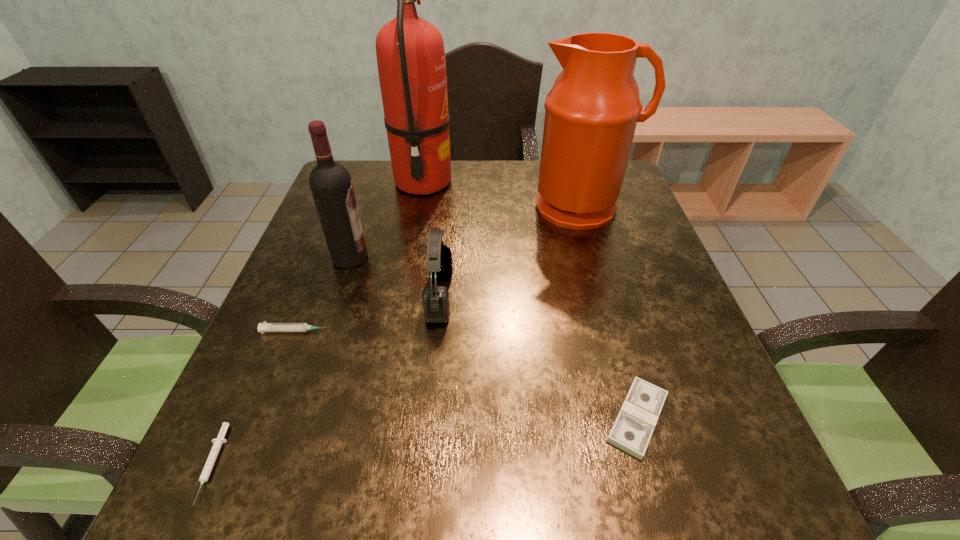
Find the location of a particular element. This screenshot has height=540, width=960. vacant area between the fifth shortest object and the second tallest object is located at coordinates (466, 232).

The width and height of the screenshot is (960, 540). I want to click on free space between the tallest object and the fifth shortest object, so click(x=387, y=220).

Image resolution: width=960 pixels, height=540 pixels. In order to click on free space between the wine bottle and the nearer syringe in this screenshot , I will do `click(280, 361)`.

Locate an element on the screen. The width and height of the screenshot is (960, 540). unoccupied position between the shorter syringe and the tallest object is located at coordinates (318, 323).

Image resolution: width=960 pixels, height=540 pixels. I want to click on object that is the fifth closest to the fourth tallest object, so click(632, 430).

Image resolution: width=960 pixels, height=540 pixels. In order to click on object that stands as the fourth closest to the fire extinguisher in this screenshot , I will do `click(263, 327)`.

Where is `vacant space that satisfies the following two spatial constraints: 1. on the back side of the dollar; 2. at the needle end of the taller syringe`? vacant space that satisfies the following two spatial constraints: 1. on the back side of the dollar; 2. at the needle end of the taller syringe is located at coordinates (612, 331).

At what (x,y) coordinates should I click in order to perform the action: click on free spot that satisfies the following two spatial constraints: 1. from the spout of the water jug; 2. at the needle end of the taller syringe. Please return your answer as a coordinate pair (x, y). The image size is (960, 540). Looking at the image, I should click on (619, 331).

At what (x,y) coordinates should I click in order to perform the action: click on vacant space that satisfies the following two spatial constraints: 1. from the spout of the water jug; 2. at the needle end of the taller syringe. Please return your answer as a coordinate pair (x, y). Looking at the image, I should click on (619, 331).

This screenshot has height=540, width=960. Find the location of `vacant area that satisfies the following two spatial constraints: 1. on the side of the fire extinguisher with the nozzle and handle; 2. on the back side of the dollar`. vacant area that satisfies the following two spatial constraints: 1. on the side of the fire extinguisher with the nozzle and handle; 2. on the back side of the dollar is located at coordinates (380, 418).